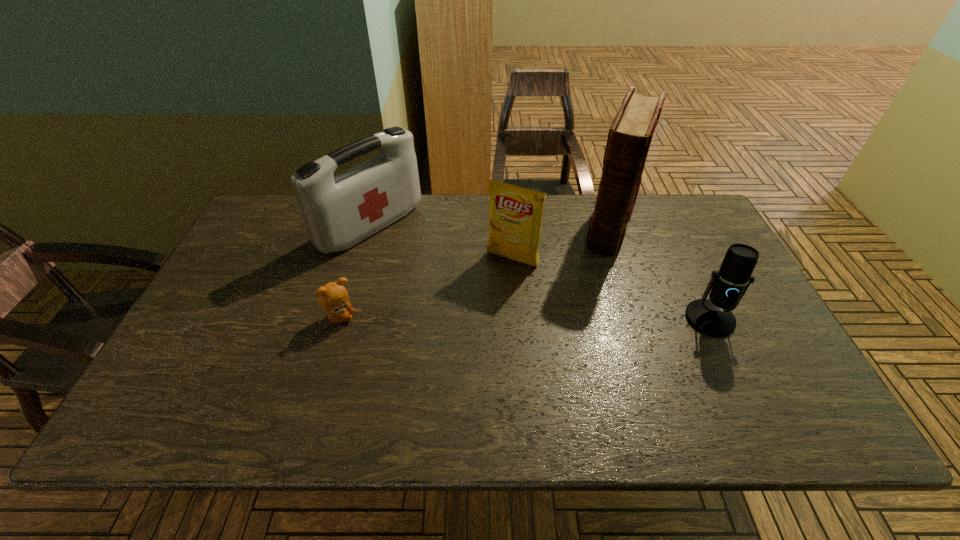
Locate an element on the screen. The image size is (960, 540). vacant space on the desktop that is between the teddy bear and the microphone and is positioned on the spine side of the tallest object is located at coordinates (577, 318).

Identify the location of vacant space on the desktop that is between the teddy bear and the microphone and is positioned on the front of the crisp (potato chip) with the logo. (476, 318).

Locate an element on the screen. Image resolution: width=960 pixels, height=540 pixels. vacant spot on the desktop that is between the teddy bear and the microphone and is positioned on the front side of the first-aid kit is located at coordinates (503, 318).